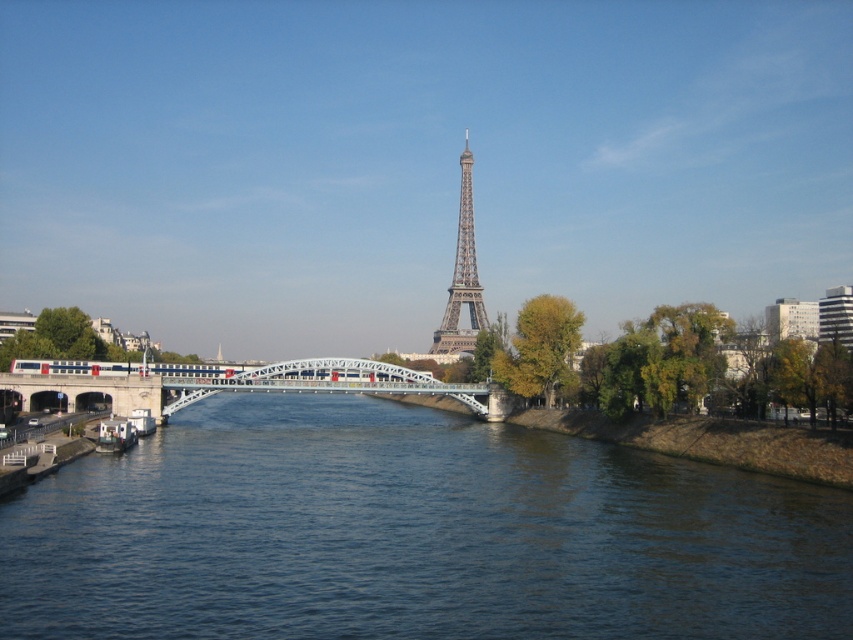
You are standing on the bridge and want to take a photo of the blue water at center. Based on its coordinates, where should you aim your camera?

The blue water at center is located at point 0.836 on the x axis and 0.485 on the y axis, so you should aim your camera towards those coordinates to capture it.

You are standing on the Seine River bridge and want to reach the point marked at coordinates (207,472). Given that your maximum walking distance is 100 meters, can you safely reach that point without exceeding your limit?

The point at (207,472) is 107.39 meters away from you, which exceeds your maximum walking distance of 100 meters. Therefore, you cannot safely reach that point without exceeding your limit.

You are planning to take a photo of the Eiffel Tower from across the Seine River. You want to ensure the blue water at center and the metallic bridge at center are both visible in the frame. Based on their sizes, which object should you focus on to include both in the composition?

The blue water at center has a larger size compared to the metallic bridge at center. To include both in the composition, focus on the blue water at center since it occupies more space, allowing the smaller metallic bridge at center to naturally fit into the frame.